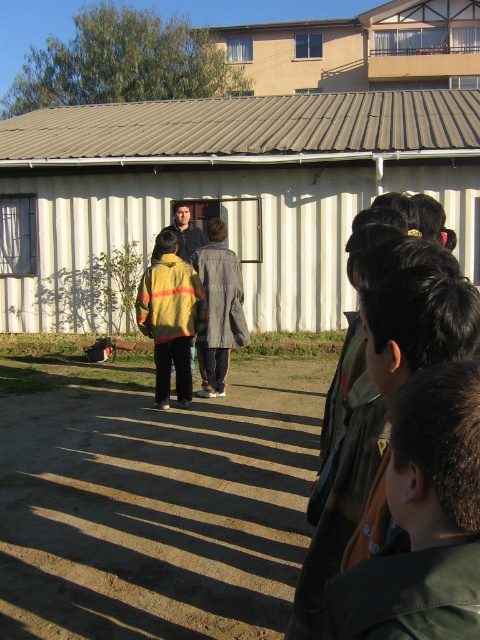
Who is shorter, gray fabric coat at center or matte black jacket at center?

matte black jacket at center

Is gray fabric coat at center wider than matte black jacket at center?

Yes.

The image size is (480, 640). What do you see at coordinates (218, 308) in the screenshot? I see `gray fabric coat at center` at bounding box center [218, 308].

The width and height of the screenshot is (480, 640). In order to click on gray fabric coat at center in this screenshot , I will do `click(218, 308)`.

Can you confirm if yellow jacket at center is taller than matte black jacket at center?

Yes, yellow jacket at center is taller than matte black jacket at center.

Which is in front, point (171, 225) or point (187, 236)?

Point (187, 236) is in front.

I want to click on yellow jacket at center, so click(186, 230).

Does white corrugated metal shed at center lie behind matte black jacket at center?

Yes, it is behind matte black jacket at center.

Is point (326, 241) in front of point (173, 211)?

Yes, it is.

Where is `white corrugated metal shed at center`? This screenshot has height=640, width=480. white corrugated metal shed at center is located at coordinates (225, 192).